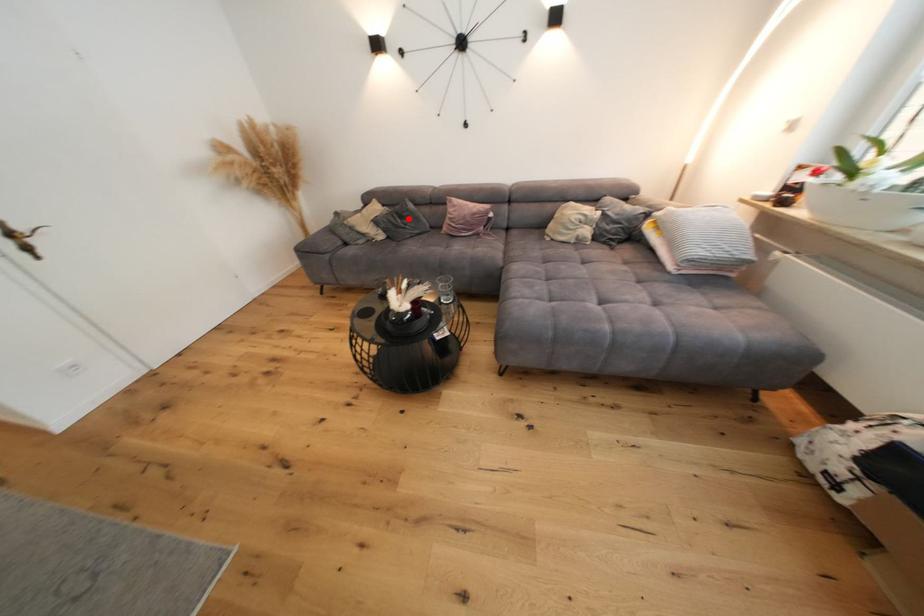
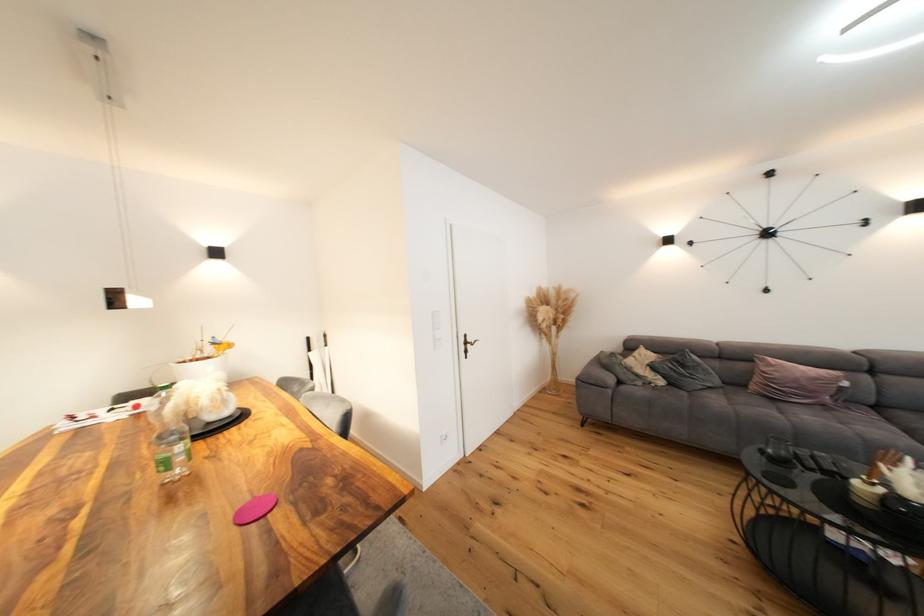
Question: I am providing you with two images of the same scene from different viewpoints. A red point is shown in image1. For the corresponding object point in image2, is it positioned nearer or farther from the camera?

Choices:
 (A) Nearer
 (B) Farther

Answer: (B)